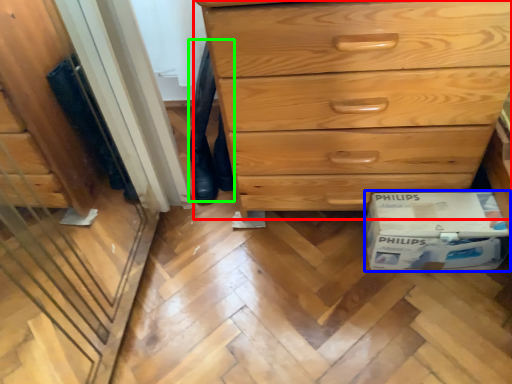
Question: Considering the real-world distances, which object is closest to chest of drawers (highlighted by a red box)? cardboard box (highlighted by a blue box) or jeans (highlighted by a green box).

Choices:
 (A) cardboard box
 (B) jeans

Answer: (A)